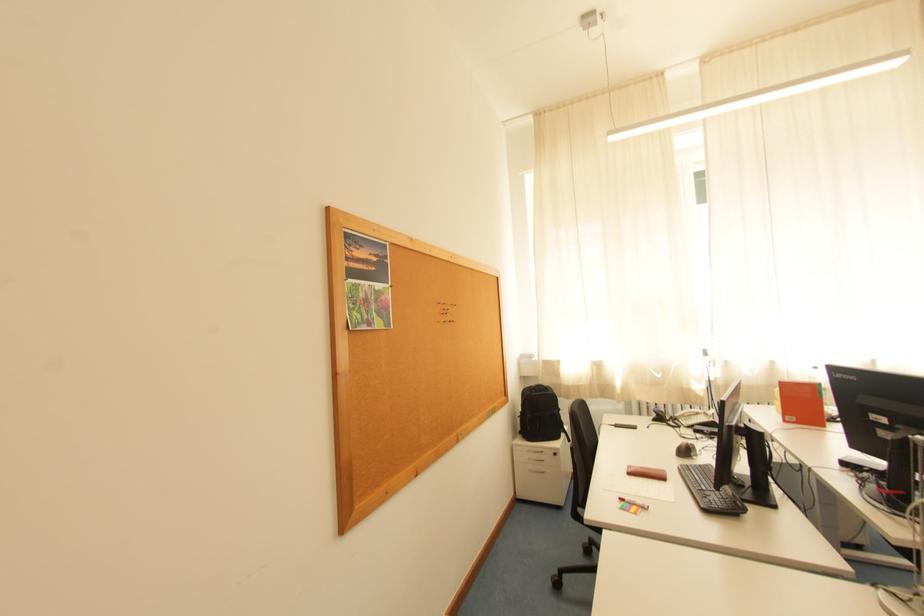
Find where to lift the phone handset. Please return your answer as a coordinate pair (x, y).

(695, 416)